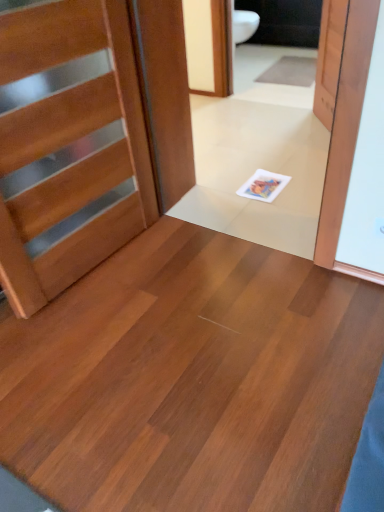
Question: Considering the relative sizes of wooden door at left, which is counted as the 2th door, starting from the right, and wooden door at upper right, marked as the second door in a front-to-back arrangement, in the image provided, is wooden door at left, which is counted as the 2th door, starting from the right, thinner than wooden door at upper right, marked as the second door in a front-to-back arrangement,?

Choices:
 (A) no
 (B) yes

Answer: (A)

Question: From a real-world perspective, is wooden door at left, marked as the second door in a back-to-front arrangement, positioned over wooden door at upper right, placed as the 1th door when sorted from back to front, based on gravity?

Choices:
 (A) no
 (B) yes

Answer: (B)

Question: Is wooden door at left, placed as the first door when sorted from front to back, completely or partially outside of wooden door at upper right, marked as the second door in a front-to-back arrangement?

Choices:
 (A) no
 (B) yes

Answer: (B)

Question: Is wooden door at left, marked as the second door in a back-to-front arrangement, next to wooden door at upper right, marked as the second door in a front-to-back arrangement?

Choices:
 (A) yes
 (B) no

Answer: (B)

Question: Is wooden door at left, marked as the second door in a back-to-front arrangement, far away from wooden door at upper right, placed as the 1th door when sorted from back to front?

Choices:
 (A) no
 (B) yes

Answer: (B)

Question: Considering their positions, is wooden door at left, which is counted as the 2th door, starting from the right, located in front of or behind gray carpet at upper center?

Choices:
 (A) behind
 (B) front

Answer: (B)

Question: Looking at the image, does wooden door at left, marked as the second door in a back-to-front arrangement, seem bigger or smaller compared to gray carpet at upper center?

Choices:
 (A) big
 (B) small

Answer: (A)

Question: In the image, is wooden door at left, marked as the 1th door in a left-to-right arrangement, on the left side or the right side of gray carpet at upper center?

Choices:
 (A) left
 (B) right

Answer: (A)

Question: In terms of height, does wooden door at left, placed as the first door when sorted from front to back, look taller or shorter compared to gray carpet at upper center?

Choices:
 (A) short
 (B) tall

Answer: (B)

Question: From the image's perspective, is wooden door at upper right, the 2th door when ordered from left to right, positioned above or below gray carpet at upper center?

Choices:
 (A) below
 (B) above

Answer: (A)

Question: Would you say wooden door at upper right, marked as the second door in a front-to-back arrangement, is to the left or to the right of gray carpet at upper center in the picture?

Choices:
 (A) left
 (B) right

Answer: (A)

Question: Is point (329, 27) positioned closer to the camera than point (271, 73)?

Choices:
 (A) farther
 (B) closer

Answer: (B)

Question: Is wooden door at upper right, which is the 1th door in right-to-left order, in front of or behind gray carpet at upper center in the image?

Choices:
 (A) behind
 (B) front

Answer: (B)

Question: Considering the positions of matte wood floor at center and wooden door at left, marked as the 1th door in a left-to-right arrangement, in the image, is matte wood floor at center wider or thinner than wooden door at left, marked as the 1th door in a left-to-right arrangement,?

Choices:
 (A) wide
 (B) thin

Answer: (A)

Question: In terms of height, does matte wood floor at center look taller or shorter compared to wooden door at left, marked as the 1th door in a left-to-right arrangement?

Choices:
 (A) tall
 (B) short

Answer: (B)